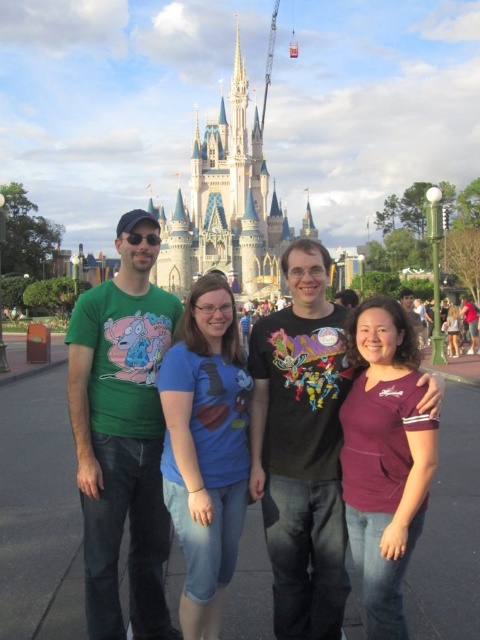
Does green cotton t-shirt at center have a lesser width compared to white stone castle at center?

In fact, green cotton t-shirt at center might be wider than white stone castle at center.

From the picture: Between green cotton t-shirt at center and white stone castle at center, which one appears on the right side from the viewer's perspective?

white stone castle at center

Measure the distance between green cotton t-shirt at center and camera.

The distance of green cotton t-shirt at center from camera is 99.96 meters.

Find the location of a particular element. green cotton t-shirt at center is located at coordinates (120, 429).